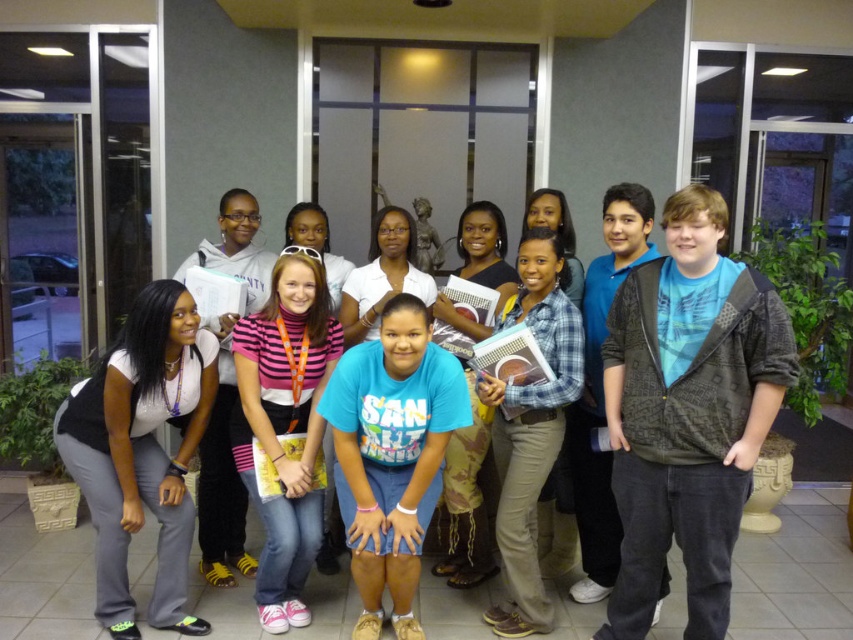
Question: Where is blue cotton shirt at center located in relation to plaid shirt at center in the image?

Choices:
 (A) below
 (B) above

Answer: (A)

Question: Which point is farther from the camera taking this photo?

Choices:
 (A) (166, 400)
 (B) (646, 380)

Answer: (A)

Question: Which object appears farthest from the camera in this image?

Choices:
 (A) pink striped turtleneck sweater at center
 (B) plaid shirt at center
 (C) white matte pants at lower left
 (D) blue printed hoodie at center

Answer: (A)

Question: Is the position of white matte pants at lower left less distant than that of pink striped turtleneck sweater at center?

Choices:
 (A) yes
 (B) no

Answer: (A)

Question: Does blue printed hoodie at center have a lesser width compared to blue cotton shirt at center?

Choices:
 (A) yes
 (B) no

Answer: (A)

Question: Estimate the real-world distances between objects in this image. Which object is farther from the blue cotton shirt at center?

Choices:
 (A) blue printed hoodie at center
 (B) pink striped turtleneck sweater at center

Answer: (A)